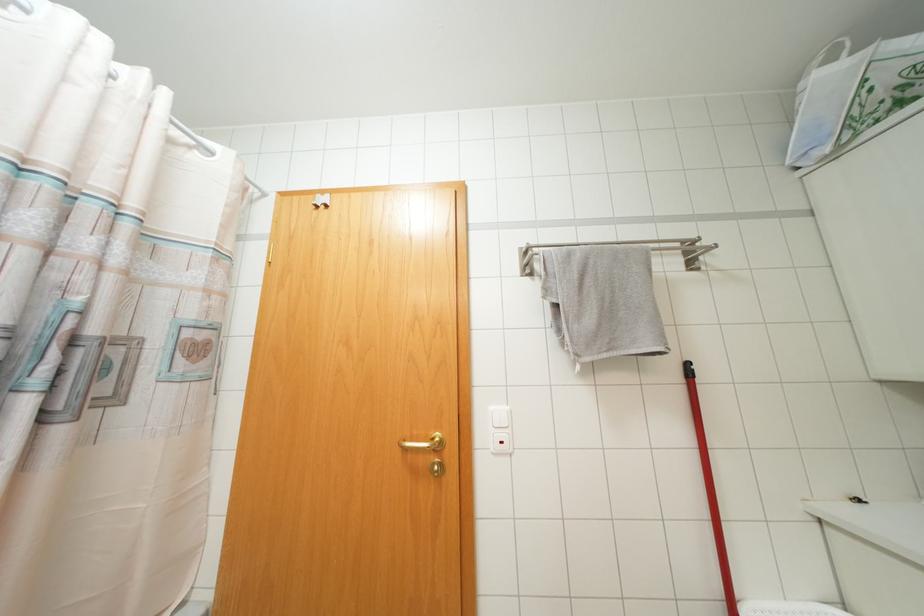
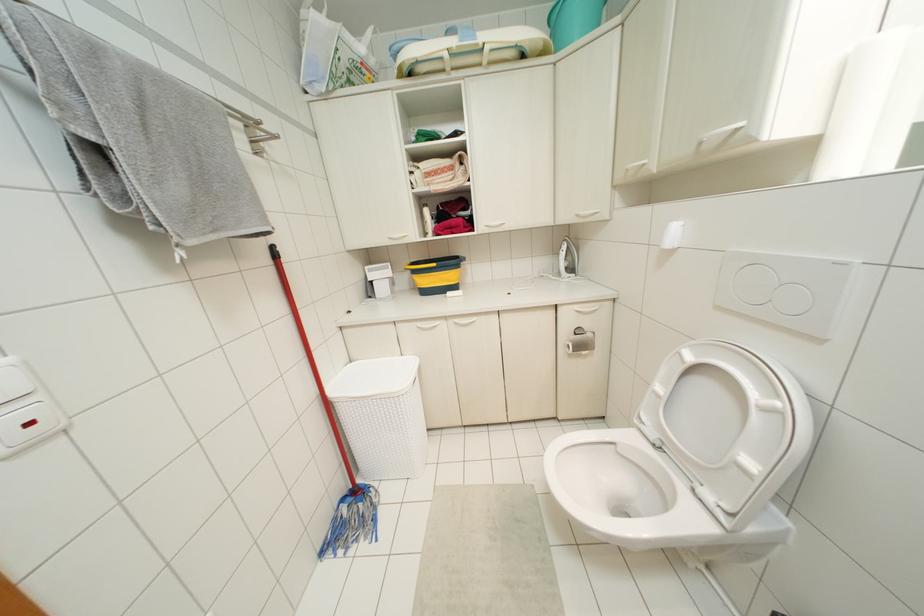
Locate, in the second image, the point that corresponds to pixel 506 408 in the first image.

(7, 360)